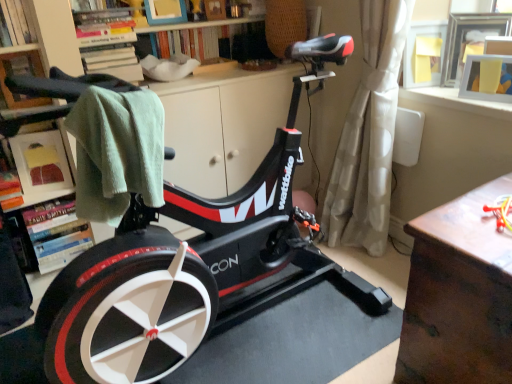
Question: Is the position of black matte stationary bicycle at center more distant than that of wooden bookshelf at upper center, positioned as the 4th shelf in front-to-back order?

Choices:
 (A) no
 (B) yes

Answer: (A)

Question: From the image's perspective, does black matte stationary bicycle at center appear higher than wooden bookshelf at upper center, positioned as the 4th shelf in front-to-back order?

Choices:
 (A) no
 (B) yes

Answer: (A)

Question: Can we say black matte stationary bicycle at center lies outside wooden bookshelf at upper center, positioned as the 4th shelf in front-to-back order?

Choices:
 (A) no
 (B) yes

Answer: (B)

Question: Does black matte stationary bicycle at center have a greater width compared to wooden bookshelf at upper center, the first shelf in the back-to-front sequence?

Choices:
 (A) no
 (B) yes

Answer: (B)

Question: Is black matte stationary bicycle at center bigger than wooden bookshelf at upper center, the first shelf in the back-to-front sequence?

Choices:
 (A) no
 (B) yes

Answer: (B)

Question: Is black matte stationary bicycle at center positioned far away from wooden bookshelf at upper center, the first shelf in the back-to-front sequence?

Choices:
 (A) yes
 (B) no

Answer: (A)

Question: Is black matte stationary bicycle at center turned away from brown wooden table at right?

Choices:
 (A) no
 (B) yes

Answer: (A)

Question: Is black matte stationary bicycle at center next to brown wooden table at right?

Choices:
 (A) yes
 (B) no

Answer: (B)

Question: Is black matte stationary bicycle at center shorter than brown wooden table at right?

Choices:
 (A) no
 (B) yes

Answer: (A)

Question: From a real-world perspective, does black matte stationary bicycle at center stand above brown wooden table at right?

Choices:
 (A) no
 (B) yes

Answer: (B)

Question: From the image's perspective, is black matte stationary bicycle at center on brown wooden table at right?

Choices:
 (A) no
 (B) yes

Answer: (B)

Question: Does black matte stationary bicycle at center have a greater width compared to brown wooden table at right?

Choices:
 (A) yes
 (B) no

Answer: (B)

Question: Does black matte stationary bicycle at center have a smaller size compared to matte black towel at left, the 4th shelf positioned from the back?

Choices:
 (A) no
 (B) yes

Answer: (A)